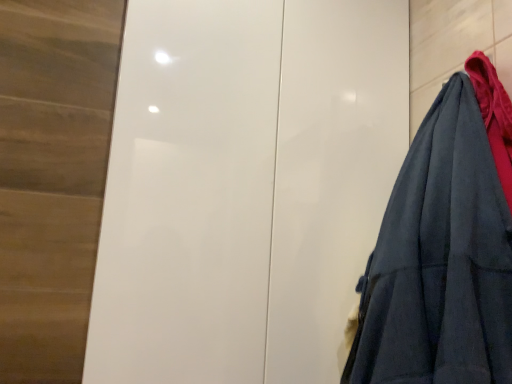
Question: Is white glossy door at center in front of or behind dark blue fabric at right in the image?

Choices:
 (A) front
 (B) behind

Answer: (B)

Question: From the image's perspective, relative to dark blue fabric at right, is white glossy door at center above or below?

Choices:
 (A) above
 (B) below

Answer: (A)

Question: Is white glossy door at center inside or outside of dark blue fabric at right?

Choices:
 (A) inside
 (B) outside

Answer: (B)

Question: From a real-world perspective, relative to white glossy door at center, is dark blue fabric at right vertically above or below?

Choices:
 (A) below
 (B) above

Answer: (A)

Question: Is dark blue fabric at right wider or thinner than white glossy door at center?

Choices:
 (A) wide
 (B) thin

Answer: (B)

Question: Is dark blue fabric at right bigger or smaller than white glossy door at center?

Choices:
 (A) big
 (B) small

Answer: (B)

Question: In the image, is dark blue fabric at right positioned in front of or behind white glossy door at center?

Choices:
 (A) behind
 (B) front

Answer: (B)